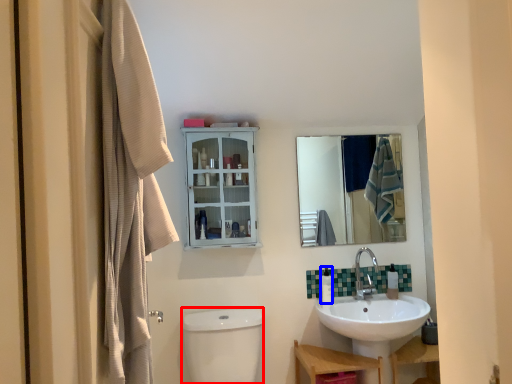
Question: Which point is further to the camera, toilet bowl (highlighted by a red box) or toiletry (highlighted by a blue box)?

Choices:
 (A) toilet bowl
 (B) toiletry

Answer: (B)